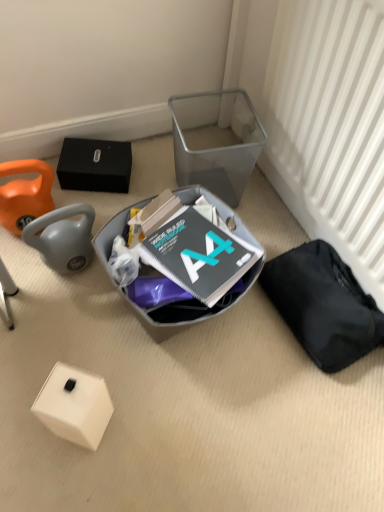
Identify the location of white textured radiator at right. (330, 127).

This screenshot has height=512, width=384. In order to click on transparent plastic shoe box at upper right in this screenshot , I will do `click(216, 141)`.

The width and height of the screenshot is (384, 512). What are the coordinates of `black fabric bag at lower right, the 2th waste in the left-to-right sequence` in the screenshot? It's located at (323, 305).

Considering the sizes of objects white textured radiator at right and matte gray plastic bin at center, marked as the 1th waste in a left-to-right arrangement, in the image provided, who is wider, white textured radiator at right or matte gray plastic bin at center, marked as the 1th waste in a left-to-right arrangement,?

Wider between the two is matte gray plastic bin at center, marked as the 1th waste in a left-to-right arrangement.

How many degrees apart are the facing directions of white textured radiator at right and matte gray plastic bin at center, marked as the 1th waste in a left-to-right arrangement?

The angle between the facing direction of white textured radiator at right and the facing direction of matte gray plastic bin at center, marked as the 1th waste in a left-to-right arrangement, is 100 degrees.

Could you measure the distance between white textured radiator at right and matte gray plastic bin at center, which appears as the second waste when viewed from the right?

white textured radiator at right and matte gray plastic bin at center, which appears as the second waste when viewed from the right, are 16.42 inches apart.

Which is in front, white textured radiator at right or matte gray plastic bin at center, which appears as the second waste when viewed from the right?

white textured radiator at right is closer to the camera.

From the image's perspective, is matte gray plastic bin at center, marked as the 1th waste in a left-to-right arrangement, beneath black fabric bag at lower right, acting as the 1th waste starting from the right?

No, from the image's perspective, matte gray plastic bin at center, marked as the 1th waste in a left-to-right arrangement, is not beneath black fabric bag at lower right, acting as the 1th waste starting from the right.

Could you tell me if matte gray plastic bin at center, marked as the 1th waste in a left-to-right arrangement, is turned towards black fabric bag at lower right, the 2th waste in the left-to-right sequence?

No, matte gray plastic bin at center, marked as the 1th waste in a left-to-right arrangement, is not oriented towards black fabric bag at lower right, the 2th waste in the left-to-right sequence.

Is matte gray plastic bin at center, which appears as the second waste when viewed from the right, far from black fabric bag at lower right, the 2th waste in the left-to-right sequence?

No, there isn't a large distance between matte gray plastic bin at center, which appears as the second waste when viewed from the right, and black fabric bag at lower right, the 2th waste in the left-to-right sequence.

From a real-world perspective, between matte gray plastic bin at center, which appears as the second waste when viewed from the right, and black fabric bag at lower right, the 2th waste in the left-to-right sequence, who is vertically lower?

black fabric bag at lower right, the 2th waste in the left-to-right sequence, is physically lower.

Measure the distance from black fabric bag at lower right, the 2th waste in the left-to-right sequence, to matte gray plastic bin at center, which appears as the second waste when viewed from the right.

black fabric bag at lower right, the 2th waste in the left-to-right sequence, is 11.15 inches away from matte gray plastic bin at center, which appears as the second waste when viewed from the right.

Is black fabric bag at lower right, acting as the 1th waste starting from the right, bigger than matte gray plastic bin at center, marked as the 1th waste in a left-to-right arrangement?

Incorrect, black fabric bag at lower right, acting as the 1th waste starting from the right, is not larger than matte gray plastic bin at center, marked as the 1th waste in a left-to-right arrangement.

Consider the image. Is black fabric bag at lower right, acting as the 1th waste starting from the right, positioned before matte gray plastic bin at center, marked as the 1th waste in a left-to-right arrangement?

No, black fabric bag at lower right, acting as the 1th waste starting from the right, is further to the viewer.

Does black fabric bag at lower right, the 2th waste in the left-to-right sequence, have a lesser height compared to matte gray plastic bin at center, marked as the 1th waste in a left-to-right arrangement?

Indeed, black fabric bag at lower right, the 2th waste in the left-to-right sequence, has a lesser height compared to matte gray plastic bin at center, marked as the 1th waste in a left-to-right arrangement.

Is point (212, 309) in front of point (52, 373)?

No, (212, 309) is further to viewer.

What are the coordinates of `waste that is the 1st object located behind the white matte box at lower left` in the screenshot? It's located at (164, 306).

Is matte gray plastic bin at center, marked as the 1th waste in a left-to-right arrangement, not close to white matte box at lower left?

matte gray plastic bin at center, marked as the 1th waste in a left-to-right arrangement, is near white matte box at lower left, not far away.

Based on the photo, from a real-world perspective, is matte gray plastic bin at center, which appears as the second waste when viewed from the right, above or below white matte box at lower left?

From a real-world perspective, matte gray plastic bin at center, which appears as the second waste when viewed from the right, is physically above white matte box at lower left.

Can you confirm if white matte box at lower left is shorter than matte gray plastic bin at center, marked as the 1th waste in a left-to-right arrangement?

Yes.

From the image's perspective, is white matte box at lower left over matte gray plastic bin at center, which appears as the second waste when viewed from the right?

No.

Is white matte box at lower left to the left of matte gray plastic bin at center, which appears as the second waste when viewed from the right, from the viewer's perspective?

Correct, you'll find white matte box at lower left to the left of matte gray plastic bin at center, which appears as the second waste when viewed from the right.

Is point (68, 414) positioned after point (334, 319)?

No, it is in front of (334, 319).

Locate an element on the screen. The height and width of the screenshot is (512, 384). the 2nd waste to the right when counting from the white matte box at lower left is located at coordinates (323, 305).

Is white matte box at lower left with black fabric bag at lower right, acting as the 1th waste starting from the right?

They are not placed beside each other.

Is black fabric bag at lower right, the 2th waste in the left-to-right sequence, completely or partially inside white matte box at lower left?

No, black fabric bag at lower right, the 2th waste in the left-to-right sequence, is not inside white matte box at lower left.

Does transparent plastic shoe box at upper right contain white textured radiator at right?

No, white textured radiator at right is not inside transparent plastic shoe box at upper right.

From a real-world perspective, who is located lower, transparent plastic shoe box at upper right or white textured radiator at right?

transparent plastic shoe box at upper right, from a real-world perspective.

Is transparent plastic shoe box at upper right with white textured radiator at right?

No, transparent plastic shoe box at upper right is not in contact with white textured radiator at right.

Consider the image. Considering the relative sizes of transparent plastic shoe box at upper right and white textured radiator at right in the image provided, is transparent plastic shoe box at upper right bigger than white textured radiator at right?

No, transparent plastic shoe box at upper right is not bigger than white textured radiator at right.

From a real-world perspective, starting from the white textured radiator at right, which waste is the 1st one below it? Please provide its 2D coordinates.

[(164, 306)]

Identify the location of waste in front of the black fabric bag at lower right, the 2th waste in the left-to-right sequence. Image resolution: width=384 pixels, height=512 pixels. (164, 306).

Looking at the image, which one is located closer to white matte box at lower left, matte gray plastic bin at center, which appears as the second waste when viewed from the right, or white textured radiator at right?

matte gray plastic bin at center, which appears as the second waste when viewed from the right.

Considering their positions, is transparent plastic shoe box at upper right positioned further to white textured radiator at right than black fabric bag at lower right, acting as the 1th waste starting from the right?

black fabric bag at lower right, acting as the 1th waste starting from the right, is positioned further to the anchor white textured radiator at right.

Looking at the image, which one is located further to white matte box at lower left, transparent plastic shoe box at upper right or black fabric bag at lower right, the 2th waste in the left-to-right sequence?

Among the two, transparent plastic shoe box at upper right is located further to white matte box at lower left.

Based on their spatial positions, is white textured radiator at right or matte gray plastic bin at center, which appears as the second waste when viewed from the right, closer to transparent plastic shoe box at upper right?

The object closer to transparent plastic shoe box at upper right is matte gray plastic bin at center, which appears as the second waste when viewed from the right.

Consider the image. Which object lies nearer to the anchor point white textured radiator at right, black fabric bag at lower right, acting as the 1th waste starting from the right, or white matte box at lower left?

Among the two, black fabric bag at lower right, acting as the 1th waste starting from the right, is located nearer to white textured radiator at right.

Based on their spatial positions, is matte gray plastic bin at center, marked as the 1th waste in a left-to-right arrangement, or black fabric bag at lower right, the 2th waste in the left-to-right sequence, closer to transparent plastic shoe box at upper right?

Among the two, matte gray plastic bin at center, marked as the 1th waste in a left-to-right arrangement, is located nearer to transparent plastic shoe box at upper right.

When comparing their distances from black fabric bag at lower right, the 2th waste in the left-to-right sequence, does white matte box at lower left or transparent plastic shoe box at upper right seem closer?

transparent plastic shoe box at upper right is closer to black fabric bag at lower right, the 2th waste in the left-to-right sequence.

From the picture: Which object lies nearer to the anchor point white textured radiator at right, black fabric bag at lower right, acting as the 1th waste starting from the right, or transparent plastic shoe box at upper right?

transparent plastic shoe box at upper right.

The image size is (384, 512). Find the location of `radiator situated between white matte box at lower left and black fabric bag at lower right, acting as the 1th waste starting from the right, from left to right`. radiator situated between white matte box at lower left and black fabric bag at lower right, acting as the 1th waste starting from the right, from left to right is located at coordinates (330, 127).

Identify the location of radiator that lies between transparent plastic shoe box at upper right and white matte box at lower left from top to bottom. (330, 127).

Where is `waste positioned between white textured radiator at right and black fabric bag at lower right, acting as the 1th waste starting from the right, from near to far`? Image resolution: width=384 pixels, height=512 pixels. waste positioned between white textured radiator at right and black fabric bag at lower right, acting as the 1th waste starting from the right, from near to far is located at coordinates (164, 306).

Locate an element on the screen. This screenshot has width=384, height=512. waste between white matte box at lower left and black fabric bag at lower right, the 2th waste in the left-to-right sequence, in the horizontal direction is located at coordinates (164, 306).